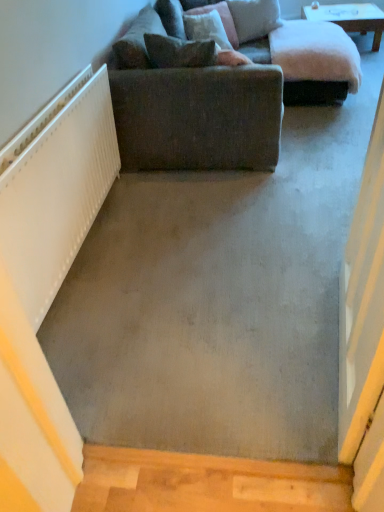
You are a GUI agent. You are given a task and a screenshot of the screen. Output one action in this format:
    pyautogui.click(x=<x>, y=<y>)
    Task: Click on the velvet pink pillow at upper center, positioned as the 2th pillow in front-to-back order
    The image size is (384, 512).
    Given the screenshot: What is the action you would take?
    pyautogui.click(x=213, y=36)

This screenshot has width=384, height=512. Identify the location of textured gray fabric couch at upper center. (217, 92).

This screenshot has width=384, height=512. Describe the element at coordinates (57, 194) in the screenshot. I see `white textured radiator at left` at that location.

Where is `fluffy pink pillow at upper center, the first pillow when ordered from back to front`? The image size is (384, 512). fluffy pink pillow at upper center, the first pillow when ordered from back to front is located at coordinates [x=254, y=18].

At what (x,y) coordinates should I click in order to perform the action: click on studio couch located on the left of fluffy pink pillow at upper center, arranged as the fourth pillow when viewed from the front. Please return your answer as a coordinate pair (x, y). This screenshot has width=384, height=512. Looking at the image, I should click on (217, 92).

Is textured gray fabric couch at upper center inside or outside of fluffy pink pillow at upper center, arranged as the fourth pillow when viewed from the front?

textured gray fabric couch at upper center is not enclosed by fluffy pink pillow at upper center, arranged as the fourth pillow when viewed from the front.

Is textured gray fabric couch at upper center far away from fluffy pink pillow at upper center, the first pillow when ordered from back to front?

Indeed, textured gray fabric couch at upper center is not near fluffy pink pillow at upper center, the first pillow when ordered from back to front.

Is textured gray fabric couch at upper center shorter than fluffy pink pillow at upper center, the first pillow when ordered from back to front?

No.

Between point (322, 7) and point (94, 144), which one is positioned behind?

The point (322, 7) is farther from the camera.

Looking at this image, does white glossy table at upper center have a lesser height compared to white textured radiator at left?

Yes, white glossy table at upper center is shorter than white textured radiator at left.

Based on the photo, considering the sizes of white glossy table at upper center and white textured radiator at left in the image, is white glossy table at upper center wider or thinner than white textured radiator at left?

In the image, white glossy table at upper center appears to be wider than white textured radiator at left.

In the scene shown: From a real-world perspective, who is located higher, white glossy table at upper center or white textured radiator at left?

In real-world perspective, white textured radiator at left is above.

Considering the relative sizes of white glossy table at upper center and velvet brown pillow at upper center, which ranks as the 3th pillow in front-to-back order, in the image provided, is white glossy table at upper center thinner than velvet brown pillow at upper center, which ranks as the 3th pillow in front-to-back order,?

Incorrect, the width of white glossy table at upper center is not less than that of velvet brown pillow at upper center, which ranks as the 3th pillow in front-to-back order.

Could you measure the distance between white glossy table at upper center and velvet brown pillow at upper center, which appears as the 2th pillow when viewed from the back?

white glossy table at upper center is 4.53 feet away from velvet brown pillow at upper center, which appears as the 2th pillow when viewed from the back.

Is white glossy table at upper center to the right of velvet brown pillow at upper center, which ranks as the 3th pillow in front-to-back order, from the viewer's perspective?

Correct, you'll find white glossy table at upper center to the right of velvet brown pillow at upper center, which ranks as the 3th pillow in front-to-back order.

Can you tell me how much white glossy table at upper center and velvet brown pillow at upper center, which appears as the 2th pillow when viewed from the back, differ in facing direction?

The facing directions of white glossy table at upper center and velvet brown pillow at upper center, which appears as the 2th pillow when viewed from the back, are 116 degrees apart.

Which is more to the right, textured gray fabric couch at upper center or velvet pink pillow at upper center, arranged as the 3th pillow when viewed from the back?

Positioned to the right is velvet pink pillow at upper center, arranged as the 3th pillow when viewed from the back.

Would you say textured gray fabric couch at upper center is outside velvet pink pillow at upper center, positioned as the 2th pillow in front-to-back order?

textured gray fabric couch at upper center lies outside velvet pink pillow at upper center, positioned as the 2th pillow in front-to-back order,'s area.

Is velvet pink pillow at upper center, positioned as the 2th pillow in front-to-back order, at the back of textured gray fabric couch at upper center?

textured gray fabric couch at upper center does not have its back to velvet pink pillow at upper center, positioned as the 2th pillow in front-to-back order.

Where is `the 1st pillow in front when counting from the white glossy table at upper center`? The width and height of the screenshot is (384, 512). the 1st pillow in front when counting from the white glossy table at upper center is located at coordinates (254, 18).

Which object is thinner, white glossy table at upper center or fluffy pink pillow at upper center, arranged as the fourth pillow when viewed from the front?

fluffy pink pillow at upper center, arranged as the fourth pillow when viewed from the front.

Consider the image. Is white glossy table at upper center turned away from fluffy pink pillow at upper center, the first pillow when ordered from back to front?

That's not correct — white glossy table at upper center is not looking away from fluffy pink pillow at upper center, the first pillow when ordered from back to front.

Which is behind, point (377, 36) or point (255, 21)?

The point (377, 36) is behind.

From a real-world perspective, who is located higher, wooden at bottom or velvet pink pillow at upper center, arranged as the 3th pillow when viewed from the back?

In real-world perspective, velvet pink pillow at upper center, arranged as the 3th pillow when viewed from the back, is above.

Is wooden at bottom beside velvet pink pillow at upper center, arranged as the 3th pillow when viewed from the back?

No, wooden at bottom is not next to velvet pink pillow at upper center, arranged as the 3th pillow when viewed from the back.

Considering the relative sizes of wooden at bottom and velvet pink pillow at upper center, positioned as the 2th pillow in front-to-back order, in the image provided, is wooden at bottom wider than velvet pink pillow at upper center, positioned as the 2th pillow in front-to-back order,?

No.

From the image's perspective, is brown fabric pillow at upper center, marked as the first pillow in a front-to-back arrangement, below wooden at bottom?

No.

Is brown fabric pillow at upper center, arranged as the fourth pillow when viewed from the back, oriented towards wooden at bottom?

No, brown fabric pillow at upper center, arranged as the fourth pillow when viewed from the back, is not turned towards wooden at bottom.

Is brown fabric pillow at upper center, arranged as the fourth pillow when viewed from the back, far away from wooden at bottom?

Yes, brown fabric pillow at upper center, arranged as the fourth pillow when viewed from the back, and wooden at bottom are located far from each other.

Considering the points (188, 56) and (124, 449), which point is behind, point (188, 56) or point (124, 449)?

The point (188, 56) is more distant.

Locate an element on the screen. This screenshot has width=384, height=512. studio couch that is in front of the fluffy pink pillow at upper center, the first pillow when ordered from back to front is located at coordinates (217, 92).

The width and height of the screenshot is (384, 512). What are the coordinates of `table above the white textured radiator at left (from the image's perspective)` in the screenshot? It's located at (350, 18).

Based on their spatial positions, is textured gray fabric couch at upper center or velvet brown pillow at upper center, which appears as the 2th pillow when viewed from the back, further from white textured radiator at left?

The object further to white textured radiator at left is velvet brown pillow at upper center, which appears as the 2th pillow when viewed from the back.

Looking at the image, which one is located closer to white textured radiator at left, white glossy table at upper center or velvet brown pillow at upper center, which appears as the 2th pillow when viewed from the back?

velvet brown pillow at upper center, which appears as the 2th pillow when viewed from the back.

Estimate the real-world distances between objects in this image. Which object is closer to fluffy pink pillow at upper center, arranged as the fourth pillow when viewed from the front, velvet brown pillow at upper center, which appears as the 2th pillow when viewed from the back, or velvet pink pillow at upper center, arranged as the 3th pillow when viewed from the back?

velvet brown pillow at upper center, which appears as the 2th pillow when viewed from the back, is closer to fluffy pink pillow at upper center, arranged as the fourth pillow when viewed from the front.

Based on their spatial positions, is velvet brown pillow at upper center, which ranks as the 3th pillow in front-to-back order, or fluffy pink pillow at upper center, arranged as the fourth pillow when viewed from the front, closer to velvet pink pillow at upper center, positioned as the 2th pillow in front-to-back order?

velvet brown pillow at upper center, which ranks as the 3th pillow in front-to-back order, lies closer to velvet pink pillow at upper center, positioned as the 2th pillow in front-to-back order, than the other object.

Based on their spatial positions, is textured gray fabric couch at upper center or white glossy table at upper center closer to white textured radiator at left?

textured gray fabric couch at upper center is positioned closer to the anchor white textured radiator at left.

Looking at the image, which one is located further to textured gray fabric couch at upper center, white glossy table at upper center or wooden at bottom?

Based on the image, white glossy table at upper center appears to be further to textured gray fabric couch at upper center.

Looking at the image, which one is located further to textured gray fabric couch at upper center, wooden at bottom or white textured radiator at left?

Among the two, wooden at bottom is located further to textured gray fabric couch at upper center.

From the image, which object appears to be nearer to velvet pink pillow at upper center, arranged as the 3th pillow when viewed from the back, fluffy pink pillow at upper center, arranged as the fourth pillow when viewed from the front, or velvet brown pillow at upper center, which ranks as the 3th pillow in front-to-back order?

The object closer to velvet pink pillow at upper center, arranged as the 3th pillow when viewed from the back, is velvet brown pillow at upper center, which ranks as the 3th pillow in front-to-back order.

Locate an element on the screen. pillow positioned between textured gray fabric couch at upper center and velvet pink pillow at upper center, arranged as the 3th pillow when viewed from the back, from near to far is located at coordinates (179, 52).

The width and height of the screenshot is (384, 512). In order to click on studio couch between fluffy pink pillow at upper center, arranged as the fourth pillow when viewed from the front, and wooden at bottom from top to bottom in this screenshot , I will do `click(217, 92)`.

Find the location of `radiator between textured gray fabric couch at upper center and wooden at bottom vertically`. radiator between textured gray fabric couch at upper center and wooden at bottom vertically is located at coordinates (57, 194).

Where is `radiator that lies between fluffy pink pillow at upper center, the first pillow when ordered from back to front, and wooden at bottom from top to bottom`? radiator that lies between fluffy pink pillow at upper center, the first pillow when ordered from back to front, and wooden at bottom from top to bottom is located at coordinates (57, 194).